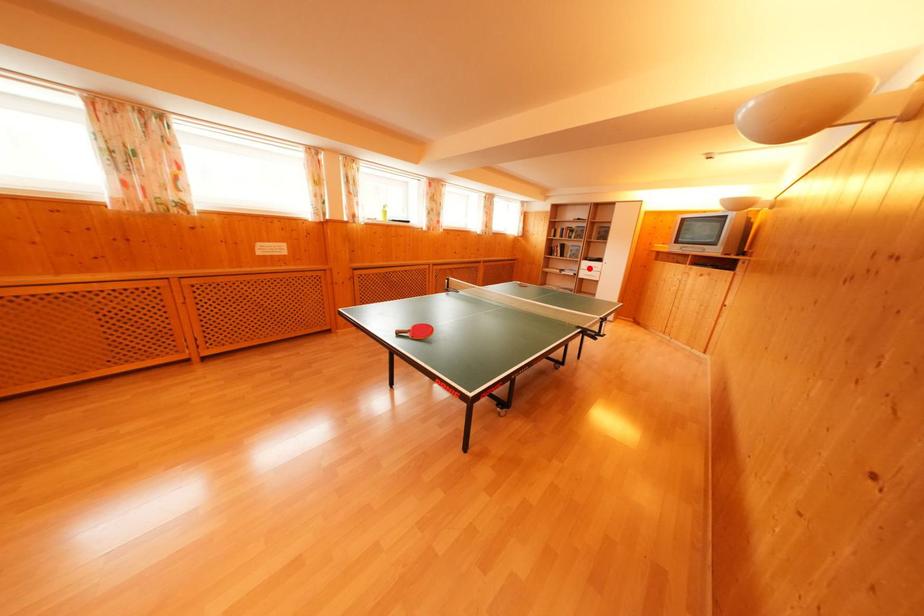
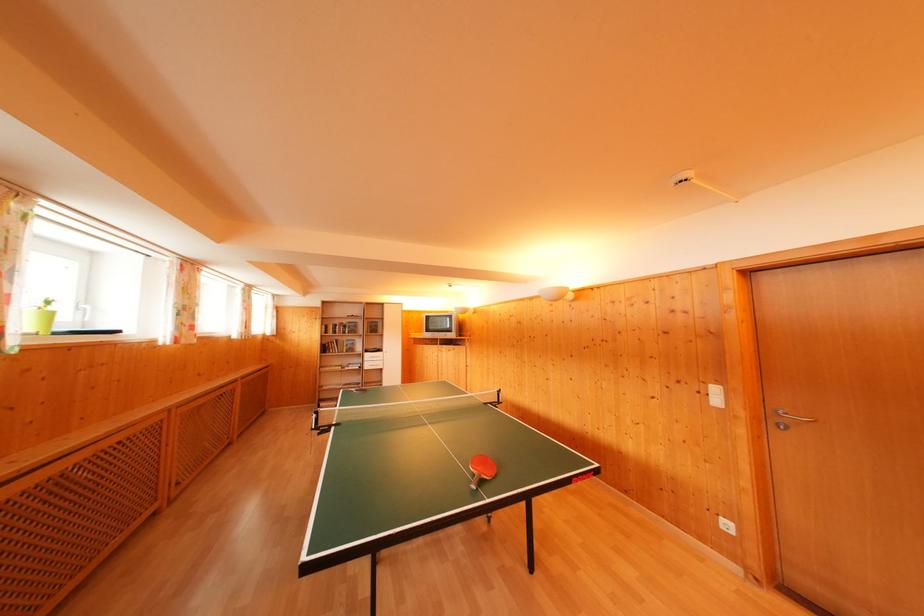
Question: I am providing you with two images of the same scene from different viewpoints. Image1 has a red point marked. In image2, the corresponding 3D location appears at what relative position? Reply with the corresponding letter.

Choices:
 (A) Closer
 (B) Farther

Answer: (B)